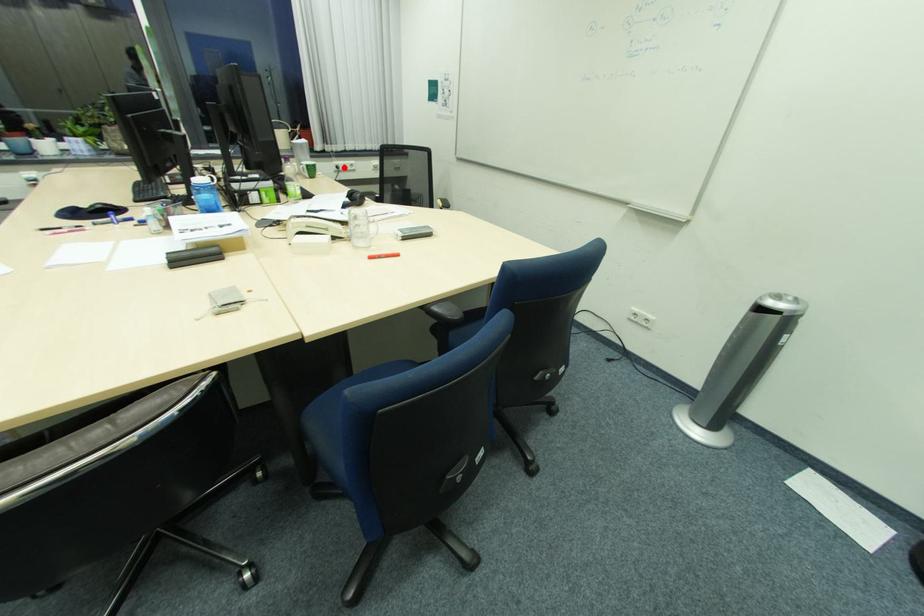
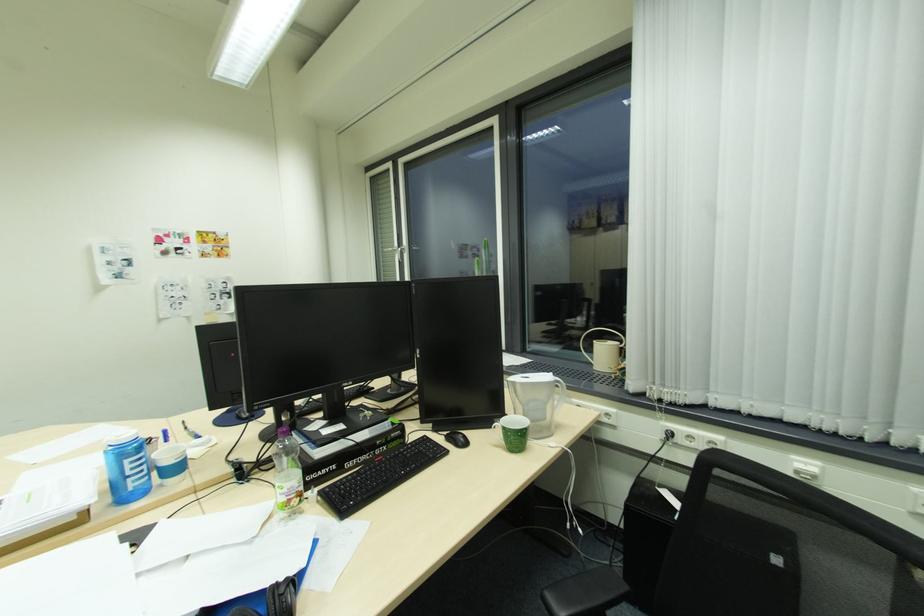
Question: I am providing you with two images of the same scene from different viewpoints. A red point is shown in image1. For the corresponding object point in image2, is it positioned nearer or farther from the camera?

Choices:
 (A) Nearer
 (B) Farther

Answer: (A)